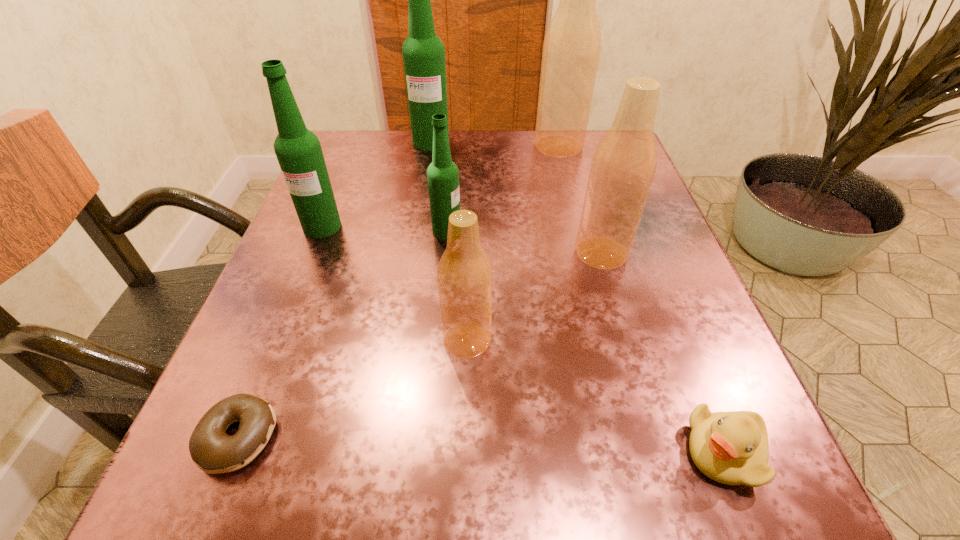
Locate an element on the screen. The height and width of the screenshot is (540, 960). the shortest object is located at coordinates (214, 451).

In order to click on brown doughnut in this screenshot , I will do `click(214, 451)`.

Image resolution: width=960 pixels, height=540 pixels. I want to click on free spot located 0.220m on the label of the farthest green beer bottle, so click(x=420, y=206).

Locate an element on the screen. The width and height of the screenshot is (960, 540). free spot located on the left of the farthest tan beer bottle is located at coordinates (446, 146).

Where is `vacant space situated 0.230m on the back of the second biggest tan beer bottle`? vacant space situated 0.230m on the back of the second biggest tan beer bottle is located at coordinates (577, 170).

Where is `vacant area located 0.290m on the label of the leftmost green beer bottle`? Image resolution: width=960 pixels, height=540 pixels. vacant area located 0.290m on the label of the leftmost green beer bottle is located at coordinates (263, 373).

In order to click on vacant region located 0.100m on the label of the smallest green beer bottle in this screenshot , I will do `click(515, 231)`.

Locate an element on the screen. The image size is (960, 540). blank space located on the right of the leftmost tan beer bottle is located at coordinates (647, 340).

The image size is (960, 540). In order to click on vacant region located on the beak of the duckling in this screenshot , I will do `click(629, 452)`.

Where is `blank space located on the beak of the duckling`? The image size is (960, 540). blank space located on the beak of the duckling is located at coordinates (430, 452).